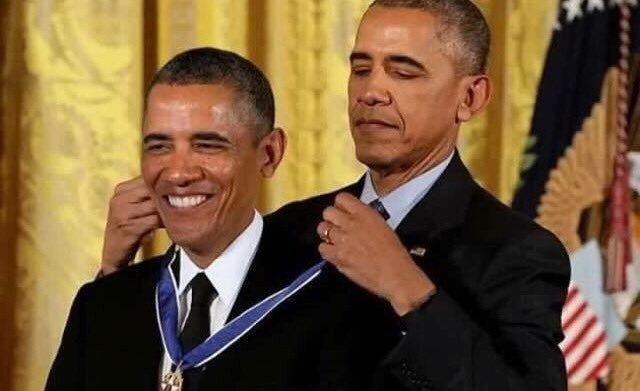
This screenshot has width=640, height=391. I want to click on yellow curtain, so click(292, 40).